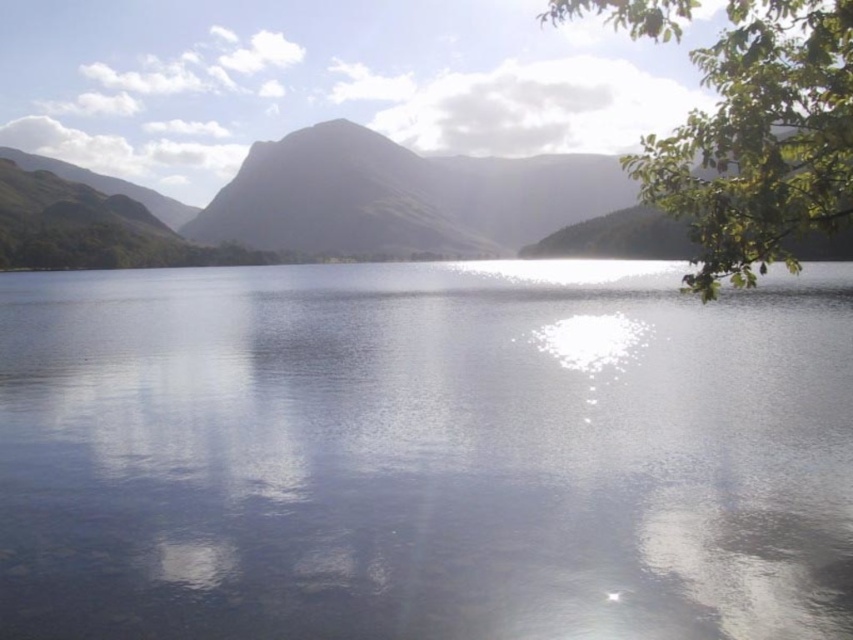
Who is positioned more to the left, clear water at center or green matte mountain at center?

From the viewer's perspective, green matte mountain at center appears more on the left side.

Is clear water at center below green matte mountain at center?

Yes.

Who is more forward, [849,508] or [7,156]?

Point [849,508] is more forward.

At what (x,y) coordinates should I click in order to perform the action: click on clear water at center. Please return your answer as a coordinate pair (x, y). Looking at the image, I should click on (425, 452).

Does clear water at center have a greater height compared to green leafy branch at upper right?

No, clear water at center is not taller than green leafy branch at upper right.

Measure the distance between clear water at center and camera.

clear water at center is 9.95 meters from camera.

Between point (117, 560) and point (747, 253), which one is positioned behind?

The point (747, 253) is behind.

Identify the location of clear water at center. This screenshot has width=853, height=640. (425, 452).

Does green leafy branch at upper right have a greater width compared to green matte mountain at center?

No, green leafy branch at upper right is not wider than green matte mountain at center.

Which is behind, point (793, 19) or point (328, 196)?

The point (328, 196) is behind.

You are a GUI agent. You are given a task and a screenshot of the screen. Output one action in this format:
    pyautogui.click(x=<x>, y=<y>)
    Task: Click on the green leafy branch at upper right
    Image resolution: width=853 pixels, height=640 pixels.
    Given the screenshot: What is the action you would take?
    pyautogui.click(x=759, y=140)